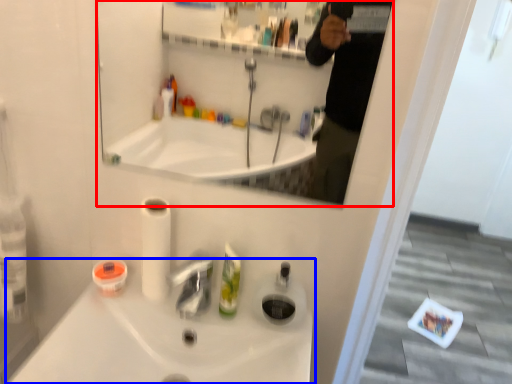
Question: Which object is further to the camera taking this photo, mirror (highlighted by a red box) or sink (highlighted by a blue box)?

Choices:
 (A) mirror
 (B) sink

Answer: (B)